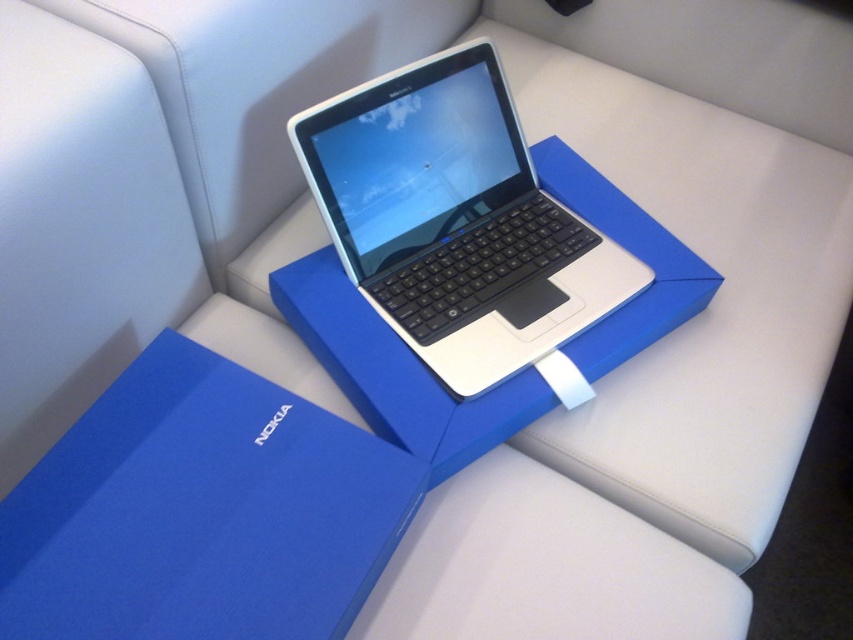
You are taking a photo of the laptop and the blue box. You want to focus on the point closer to the camera between point (378, 525) and point (578, 392). Which point should you focus on?

Point (378, 525) is closer to the camera than point (578, 392), so you should focus on point (378, 525).

You are a delivery person who just arrived at a customer delivery address. You see the blue matte cardboard box at center and the white glossy laptop at center. Which object is closer to the floor?

The blue matte cardboard box at center is below the white glossy laptop at center, so the blue matte cardboard box at center is closer to the floor.

You are a delivery person who just arrived at a client location. You see a blue matte cardboard box at center and a white glossy laptop at center. The client wants to know if the laptop is currently inside the box. Can you confirm?

The blue matte cardboard box at center is in front of the white glossy laptop at center, so the laptop is not inside the box. The box is positioned in front of the laptop, meaning the laptop is outside the box.